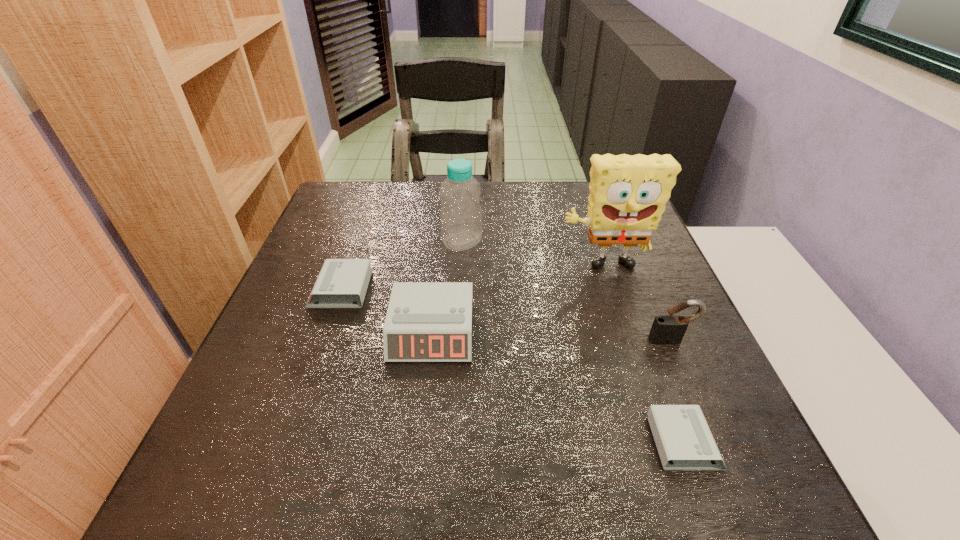
You are a GUI agent. You are given a task and a screenshot of the screen. Output one action in this format:
    pyautogui.click(x=<x>, y=<y>)
    Task: Click on the padlock positioned at the right edge
    
    Given the screenshot: What is the action you would take?
    pyautogui.click(x=669, y=329)

Where is `object that is positioned at the near right corner`? The image size is (960, 540). object that is positioned at the near right corner is located at coordinates (681, 433).

Where is `vacant area at the far edge of the desktop`? vacant area at the far edge of the desktop is located at coordinates (483, 216).

Image resolution: width=960 pixels, height=540 pixels. Identify the location of vacant position at the near edge of the desktop. (495, 421).

Identify the location of free location at the left edge. This screenshot has height=540, width=960. (306, 366).

Where is `vacant space at the right edge`? The width and height of the screenshot is (960, 540). vacant space at the right edge is located at coordinates (652, 252).

This screenshot has height=540, width=960. Find the location of `vacant region at the far left corner of the desktop`. vacant region at the far left corner of the desktop is located at coordinates (376, 182).

This screenshot has height=540, width=960. I want to click on vacant space at the near left corner of the desktop, so click(295, 399).

Image resolution: width=960 pixels, height=540 pixels. In order to click on vacant area at the far right corner of the desktop in this screenshot , I will do coord(585,201).

What are the coordinates of `unoccupied area between the tallest object and the shortest alarm clock` in the screenshot? It's located at (643, 355).